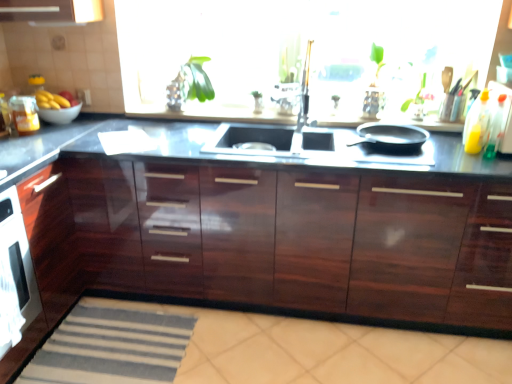
Question: Should I look upward or downward to see transparent glass window at center?

Choices:
 (A) up
 (B) down

Answer: (A)

Question: Is black matte frying pan at right at the right side of translucent plastic bottle at right, the first bottle when ordered from back to front?

Choices:
 (A) yes
 (B) no

Answer: (B)

Question: Is black matte frying pan at right located outside translucent plastic bottle at right, the first bottle when ordered from back to front?

Choices:
 (A) no
 (B) yes

Answer: (B)

Question: Does black matte frying pan at right have a lesser height compared to translucent plastic bottle at right, the first bottle when ordered from back to front?

Choices:
 (A) yes
 (B) no

Answer: (A)

Question: Is the surface of black matte frying pan at right in direct contact with translucent plastic bottle at right, the first bottle when ordered from back to front?

Choices:
 (A) no
 (B) yes

Answer: (A)

Question: From the image's perspective, is black matte frying pan at right below translucent plastic bottle at right, positioned as the second bottle in front-to-back order?

Choices:
 (A) no
 (B) yes

Answer: (B)

Question: Considering the relative sizes of black matte frying pan at right and translucent plastic bottle at right, positioned as the second bottle in front-to-back order, in the image provided, is black matte frying pan at right taller than translucent plastic bottle at right, positioned as the second bottle in front-to-back order,?

Choices:
 (A) no
 (B) yes

Answer: (A)

Question: Is the depth of glossy black countertop at center less than that of black matte frying pan at right?

Choices:
 (A) yes
 (B) no

Answer: (A)

Question: Considering the relative sizes of glossy black countertop at center and black matte frying pan at right in the image provided, is glossy black countertop at center wider than black matte frying pan at right?

Choices:
 (A) no
 (B) yes

Answer: (B)

Question: Would you say glossy black countertop at center contains black matte frying pan at right?

Choices:
 (A) yes
 (B) no

Answer: (B)

Question: Is glossy black countertop at center positioned with its back to black matte frying pan at right?

Choices:
 (A) no
 (B) yes

Answer: (A)

Question: Does glossy black countertop at center appear on the left side of black matte frying pan at right?

Choices:
 (A) yes
 (B) no

Answer: (A)

Question: Does glossy black countertop at center have a lesser width compared to black matte frying pan at right?

Choices:
 (A) yes
 (B) no

Answer: (B)

Question: From the image's perspective, is yellow matte bananas at left below glossy black countertop at center?

Choices:
 (A) no
 (B) yes

Answer: (A)